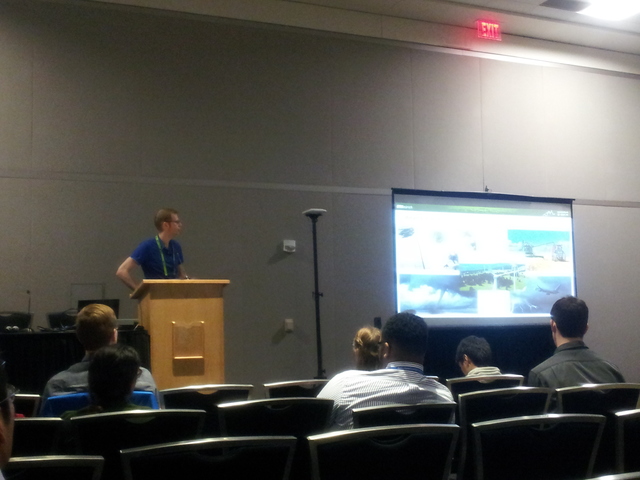
The image size is (640, 480). I want to click on walls, so click(x=310, y=135).